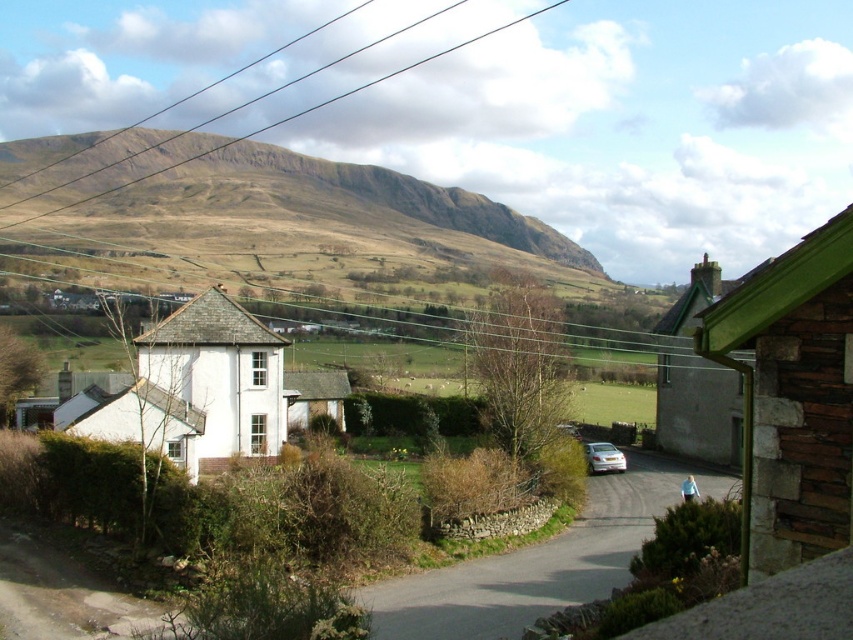
Question: Which object is farther from the camera taking this photo?

Choices:
 (A) green wooden house at right
 (B) white smooth house at center
 (C) green wooden cottage at upper right

Answer: (B)

Question: Which object appears closest to the camera in this image?

Choices:
 (A) green wooden cottage at upper right
 (B) green wooden house at right
 (C) smooth wire at upper center

Answer: (B)

Question: Does green wooden cottage at upper right lie in front of silver metallic car at center?

Choices:
 (A) no
 (B) yes

Answer: (B)

Question: Can you confirm if green wooden house at right is positioned below silver metallic car at center?

Choices:
 (A) no
 (B) yes

Answer: (A)

Question: Can you confirm if green wooden cottage at upper right is smaller than silver metallic car at center?

Choices:
 (A) yes
 (B) no

Answer: (B)

Question: Among these objects, which one is farthest from the camera?

Choices:
 (A) green wooden cottage at upper right
 (B) smooth wire at upper center
 (C) silver metallic car at center
 (D) white smooth house at center

Answer: (B)